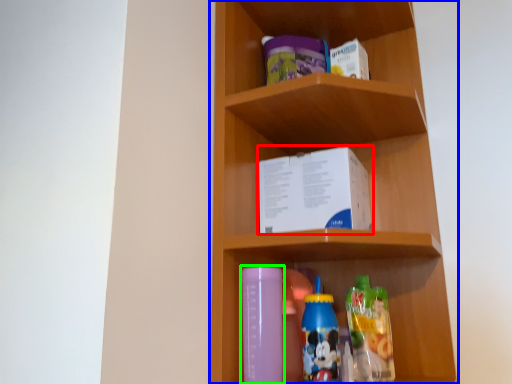
Question: Which object is positioned farthest from book (highlighted by a red box)? Select from shelf (highlighted by a blue box) and bottle (highlighted by a green box).

Choices:
 (A) shelf
 (B) bottle

Answer: (B)